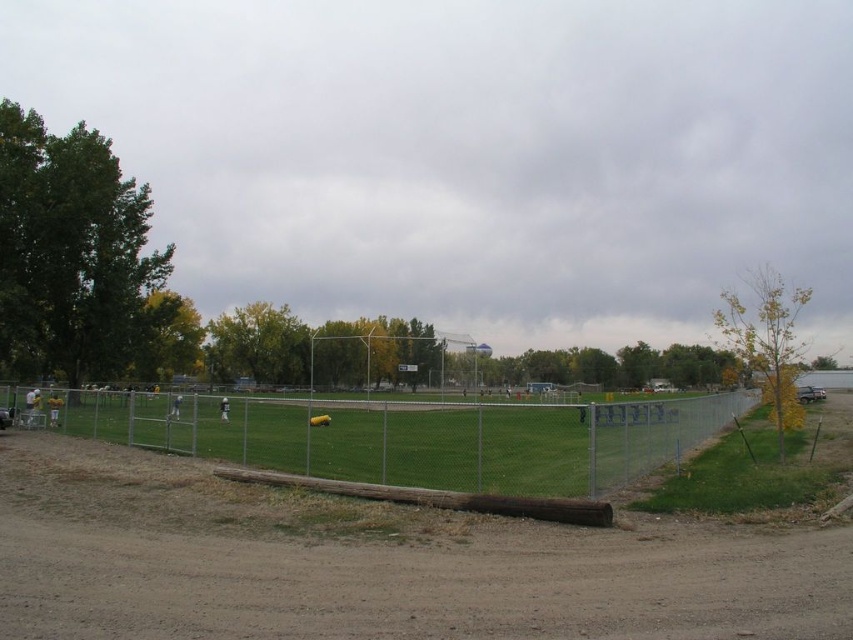
Question: Which point is farther to the camera?

Choices:
 (A) (160, 556)
 (B) (730, 404)

Answer: (B)

Question: Does brown dirt field at center have a lesser width compared to silver chain-link fence at center?

Choices:
 (A) no
 (B) yes

Answer: (B)

Question: Does brown dirt field at center have a lesser width compared to silver chain-link fence at center?

Choices:
 (A) no
 (B) yes

Answer: (B)

Question: Observing the image, what is the correct spatial positioning of brown dirt field at center in reference to silver chain-link fence at center?

Choices:
 (A) right
 (B) left

Answer: (B)

Question: Which object appears farthest from the camera in this image?

Choices:
 (A) silver chain-link fence at center
 (B) brown dirt field at center

Answer: (A)

Question: Which point appears farthest from the camera in this image?

Choices:
 (A) (589, 458)
 (B) (469, 586)

Answer: (A)